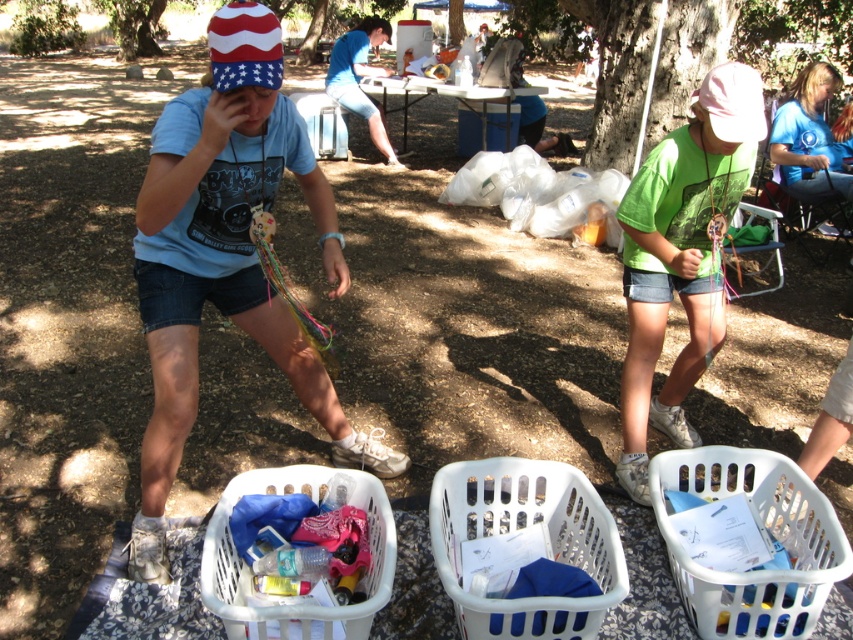
You are a delivery person standing at the camera position. You need to place a package that is 1.8 meters long into the white plastic basket at lower right. Can the package fit in the basket?

The distance of white plastic basket at lower right from camera is 1.77 meters, so the package that is 1.8 meters long cannot fit into the basket since it is slightly longer than the basket depth.